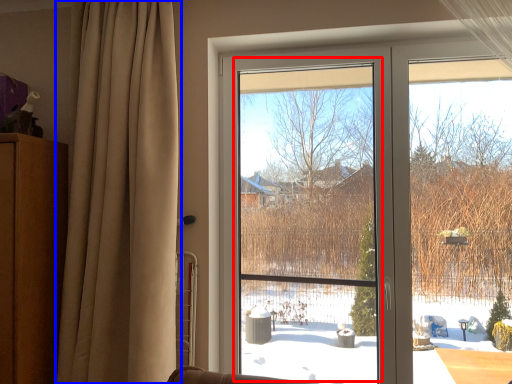
Question: Which point is further to the camera, window screen (highlighted by a red box) or curtain (highlighted by a blue box)?

Choices:
 (A) window screen
 (B) curtain

Answer: (A)